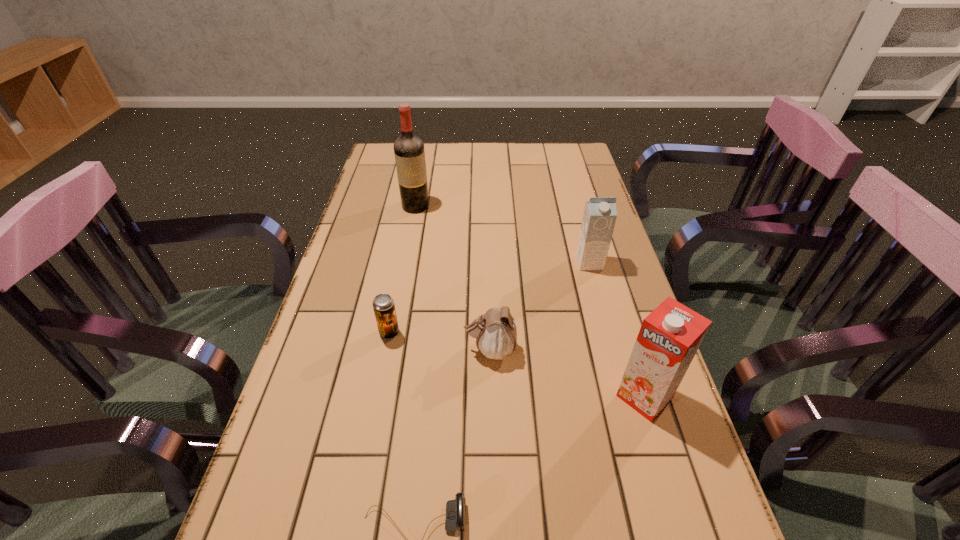
The image size is (960, 540). Identify the location of vacant position located on the front label of the shorter carton. (596, 286).

Image resolution: width=960 pixels, height=540 pixels. What are the coordinates of `vacant position located 0.350m on the front-facing side of the pouch` in the screenshot? It's located at (310, 350).

Find the location of a particular element. vacant space located on the front-facing side of the pouch is located at coordinates (372, 350).

Find the location of a particular element. free spot located 0.050m on the front-facing side of the pouch is located at coordinates (443, 350).

You are a GUI agent. You are given a task and a screenshot of the screen. Output one action in this format:
    pyautogui.click(x=<x>, y=<y>)
    Task: Click on the free space located 0.280m on the front of the second shortest object
    The image size is (960, 540).
    Given the screenshot: What is the action you would take?
    pyautogui.click(x=365, y=459)

Where is `liquor at the left edge`? The image size is (960, 540). liquor at the left edge is located at coordinates (409, 152).

The image size is (960, 540). What are the coordinates of `beer can that is positioned at the left edge` in the screenshot? It's located at (383, 304).

This screenshot has height=540, width=960. I want to click on blank space at the far edge, so click(461, 158).

Locate an element on the screen. The height and width of the screenshot is (540, 960). vacant area at the left edge of the desktop is located at coordinates (390, 215).

The image size is (960, 540). What are the coordinates of `blank area at the right edge` in the screenshot? It's located at (615, 287).